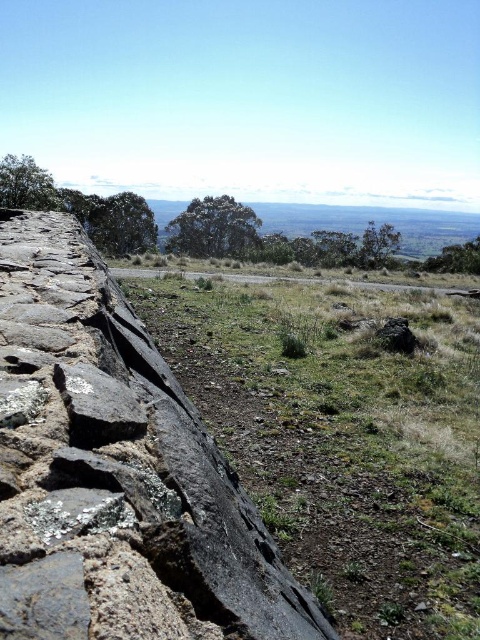
Question: Which of the following is the farthest from the observer?

Choices:
 (A) gray rock at center
 (B) dark gray stone wall at left

Answer: (A)

Question: Which object is farther from the camera taking this photo?

Choices:
 (A) dark gray stone wall at left
 (B) gray rock at center

Answer: (B)

Question: In this image, where is dark gray stone wall at left located relative to gray rock at center?

Choices:
 (A) left
 (B) right

Answer: (A)

Question: Which of the following is the farthest from the observer?

Choices:
 (A) (23, 483)
 (B) (273, 394)

Answer: (B)

Question: Does dark gray stone wall at left have a smaller size compared to gray rock at center?

Choices:
 (A) no
 (B) yes

Answer: (B)

Question: Can you confirm if dark gray stone wall at left is wider than gray rock at center?

Choices:
 (A) no
 (B) yes

Answer: (A)